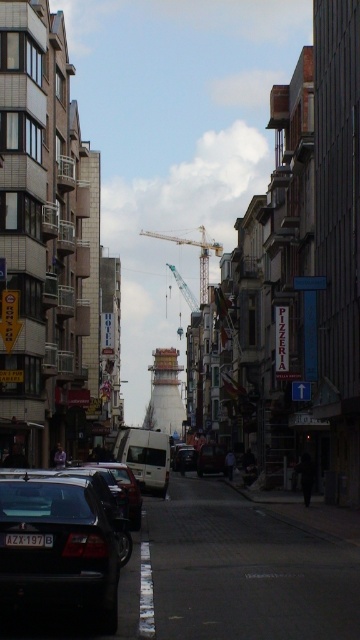
Measure the distance from yellow metallic crane at center to shiny silver van at center.

yellow metallic crane at center and shiny silver van at center are 458.36 feet apart.

Is point (206, 264) positioned after point (210, 460)?

Yes, point (206, 264) is farther from viewer.

At what (x,y) coordinates should I click in order to perform the action: click on yellow metallic crane at center. Please return your answer as a coordinate pair (x, y). The image size is (360, 640). Looking at the image, I should click on (199, 257).

Based on the photo, is yellow metallic crane at center to the left of metallic silver van at center from the viewer's perspective?

Indeed, yellow metallic crane at center is positioned on the left side of metallic silver van at center.

This screenshot has height=640, width=360. I want to click on yellow metallic crane at center, so click(x=199, y=257).

This screenshot has height=640, width=360. Identify the location of yellow metallic crane at center. (199, 257).

Can you confirm if shiny black sedan at lower left is wider than metallic silver van at center?

No.

Between shiny black sedan at lower left and metallic silver van at center, which one has less height?

metallic silver van at center is shorter.

This screenshot has width=360, height=640. Describe the element at coordinates (57, 545) in the screenshot. I see `shiny black sedan at lower left` at that location.

Locate an element on the screen. The image size is (360, 640). shiny black sedan at lower left is located at coordinates (57, 545).